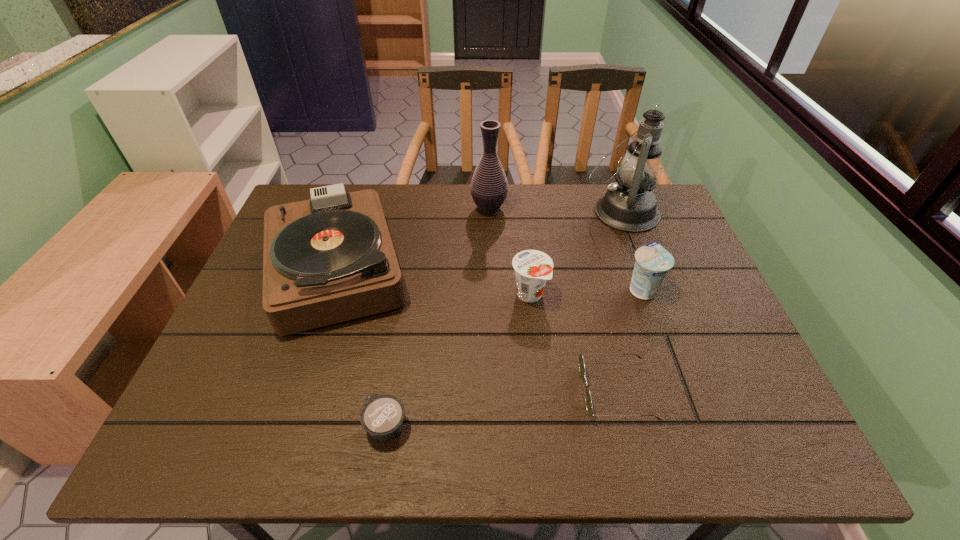
Select which object appears as the fifth closest to the second yogurt from left to right. Please provide its 2D coordinates. Your answer should be formatted as a tuple, i.e. [(x, y)], where the tuple contains the x and y coordinates of a point satisfying the conditions above.

[(329, 259)]

Select which yogurt is the closest to the leftmost yogurt. Please provide its 2D coordinates. Your answer should be formatted as a tuple, i.e. [(x, y)], where the tuple contains the x and y coordinates of a point satisfying the conditions above.

[(533, 268)]

You are a GUI agent. You are given a task and a screenshot of the screen. Output one action in this format:
    pyautogui.click(x=<x>, y=<y>)
    Task: Click on the yogurt object that ranks as the third closest to the vase
    
    Given the screenshot: What is the action you would take?
    pyautogui.click(x=382, y=416)

Where is `free region that satisfies the following two spatial constraints: 1. on the back side of the record player; 2. on the right side of the tallest object`? The height and width of the screenshot is (540, 960). free region that satisfies the following two spatial constraints: 1. on the back side of the record player; 2. on the right side of the tallest object is located at coordinates (355, 212).